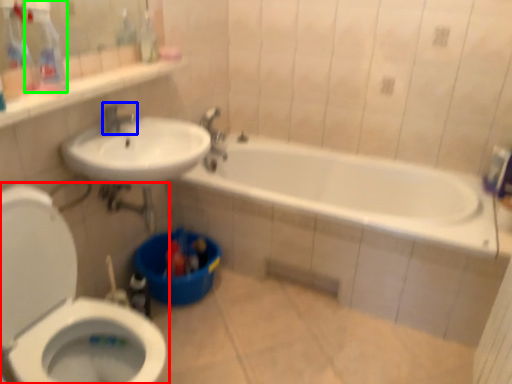
Question: Considering the real-world distances, which object is farthest from toilet (highlighted by a red box)? tap (highlighted by a blue box) or cleaning product (highlighted by a green box)?

Choices:
 (A) tap
 (B) cleaning product

Answer: (A)